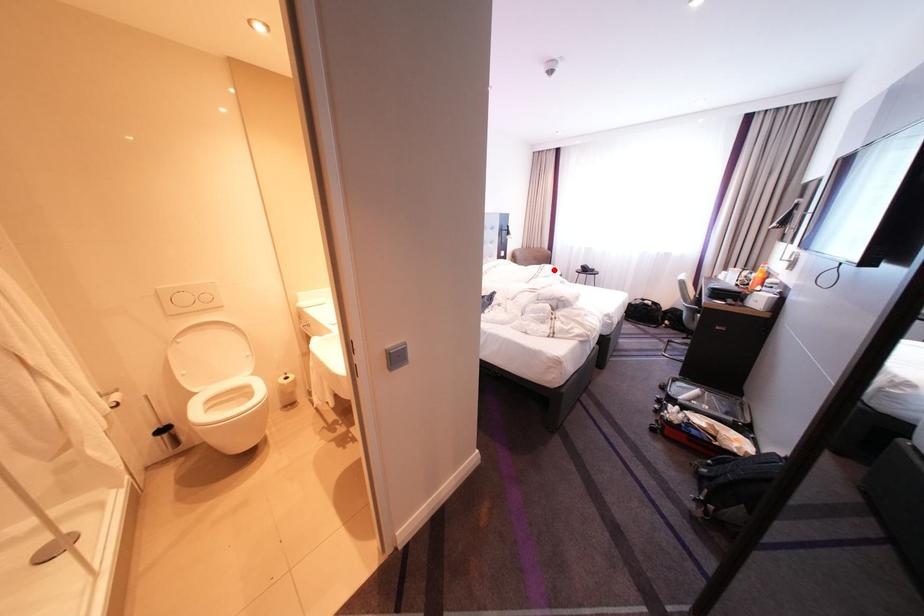
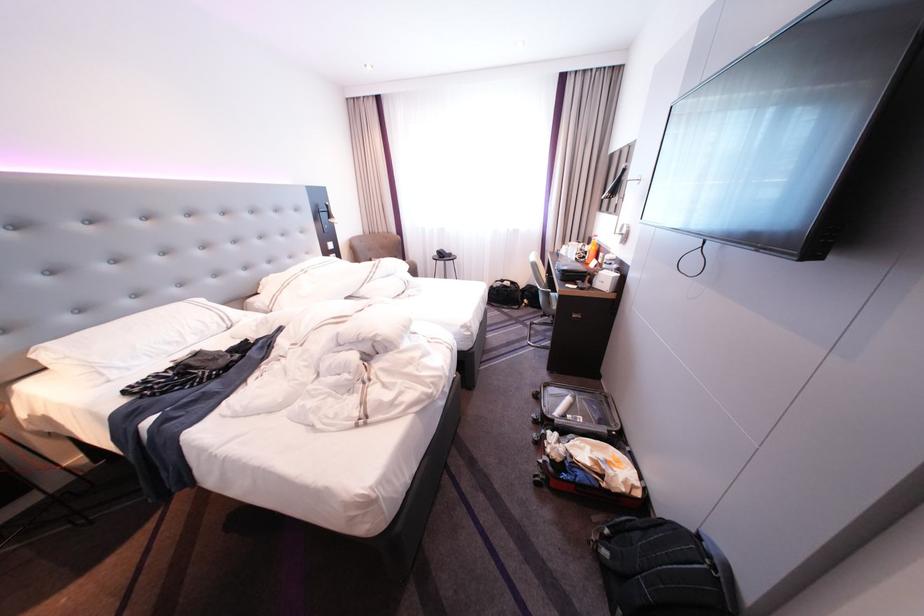
The point at the highlighted location is marked in the first image. Where is the corresponding point in the second image?

(390, 267)